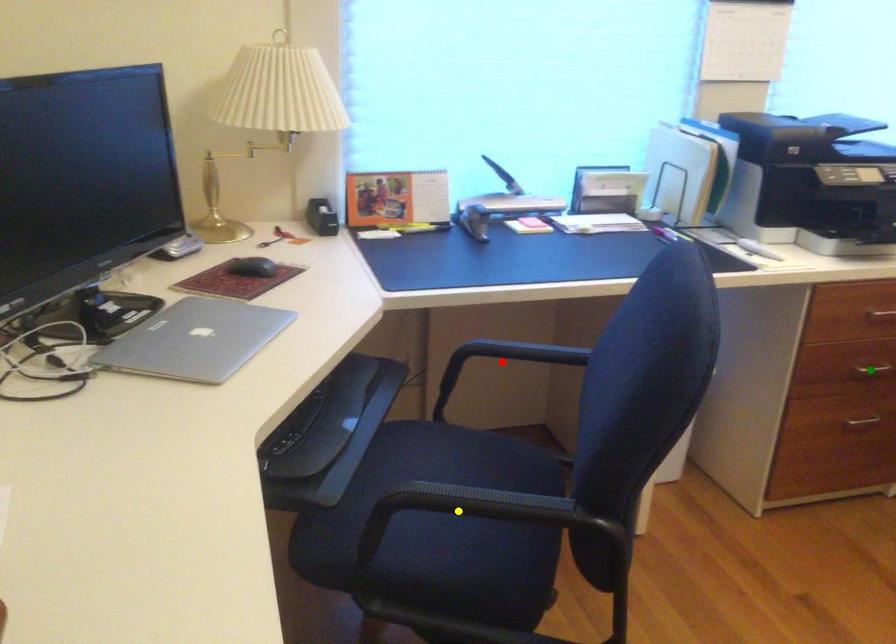
Order these from nearest to farthest:
green point
red point
yellow point

red point → green point → yellow point